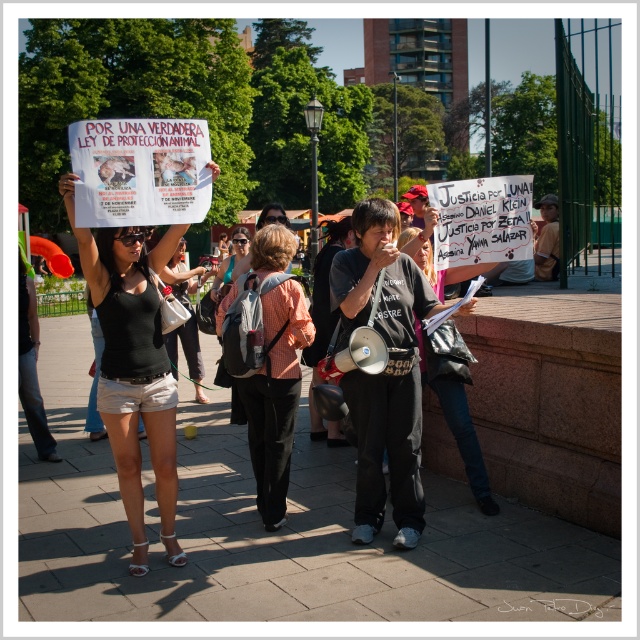
Question: Is black fabric shorts at lower left above matte black tank top at center?

Choices:
 (A) yes
 (B) no

Answer: (B)

Question: Is black fabric shorts at lower left bigger than orange checkered shirt at center?

Choices:
 (A) no
 (B) yes

Answer: (B)

Question: Based on their relative distances, which object is farther from the matte black tank top at center?

Choices:
 (A) orange checkered shirt at center
 (B) black fabric shorts at lower left

Answer: (B)

Question: Among these objects, which one is nearest to the camera?

Choices:
 (A) matte black tank top at center
 (B) black fabric shorts at lower left
 (C) orange checkered shirt at center

Answer: (B)

Question: Which point is farther to the camera?

Choices:
 (A) orange checkered shirt at center
 (B) black fabric shorts at lower left

Answer: (A)

Question: From the image, what is the correct spatial relationship of black fabric shorts at lower left in relation to orange checkered shirt at center?

Choices:
 (A) below
 (B) above

Answer: (B)